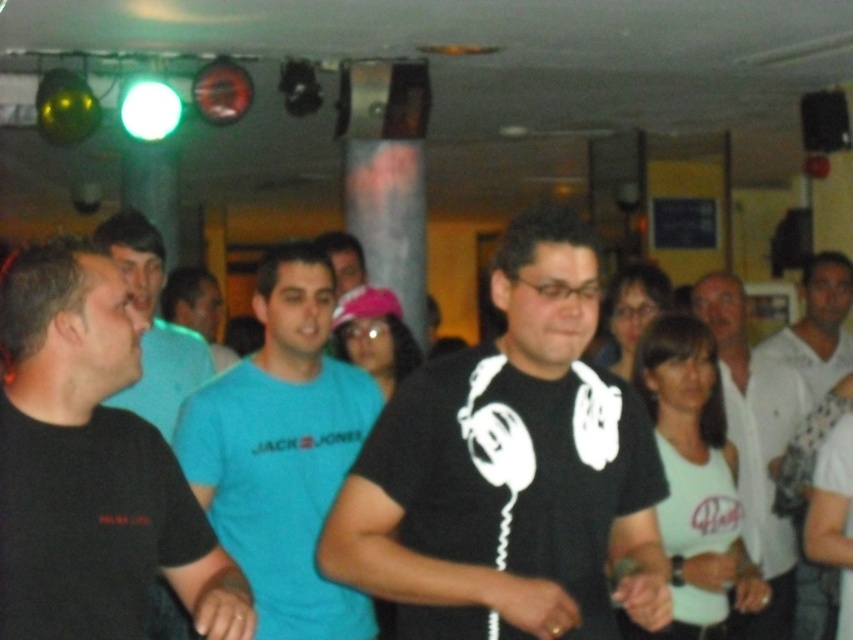
Is white matte shirt at right below blue t-shirt at center?

Yes.

Which of these two, white matte shirt at right or blue t-shirt at center, stands taller?

With more height is white matte shirt at right.

Who is more distant from viewer, (740, 340) or (213, 276)?

The point (213, 276) is more distant.

Identify the location of white matte shirt at right. This screenshot has height=640, width=853. (755, 445).

Which is more to the right, black matte t-shirt at center or blue t-shirt at center?

black matte t-shirt at center is more to the right.

Is black matte t-shirt at center positioned at the back of blue t-shirt at center?

No, black matte t-shirt at center is in front of blue t-shirt at center.

Is point (660, 580) more distant than point (183, 276)?

No, it is in front of (183, 276).

Where is `black matte t-shirt at center`? The height and width of the screenshot is (640, 853). black matte t-shirt at center is located at coordinates (509, 470).

Between black matte t-shirt at left and blue t-shirt at center, which one has less height?

blue t-shirt at center

Can you confirm if black matte t-shirt at left is bigger than blue t-shirt at center?

No.

Is point (3, 532) closer to camera compared to point (202, 269)?

That is True.

The width and height of the screenshot is (853, 640). Find the location of `black matte t-shirt at left`. black matte t-shirt at left is located at coordinates (91, 467).